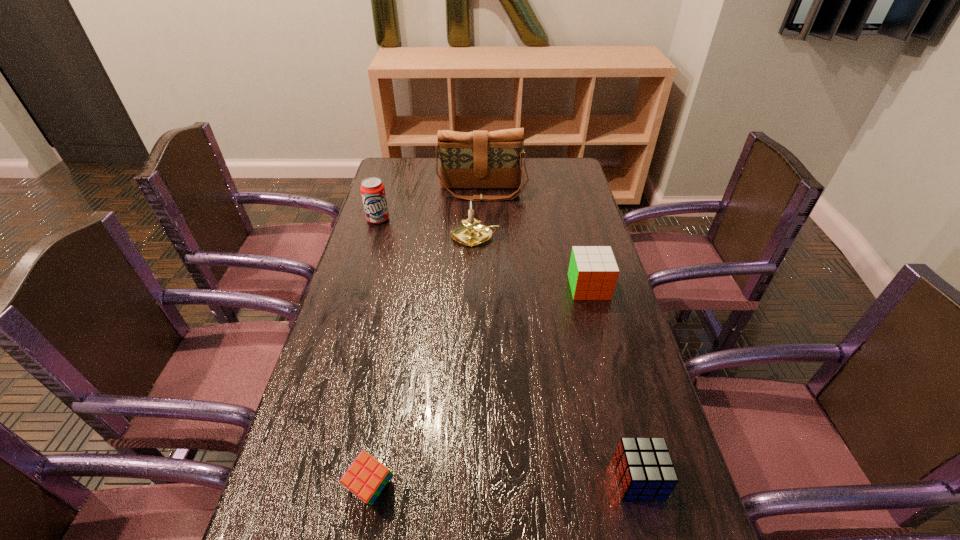
Point out which cube is positioned as the third nearest to the tallest object. Please provide its 2D coordinates. Your answer should be formatted as a tuple, i.e. [(x, y)], where the tuple contains the x and y coordinates of a point satisfying the conditions above.

[(366, 477)]

Where is `free space that satisfies the following two spatial constraints: 1. on the front-facing side of the shoulder bag; 2. on the handle side of the candle holder`? Image resolution: width=960 pixels, height=540 pixels. free space that satisfies the following two spatial constraints: 1. on the front-facing side of the shoulder bag; 2. on the handle side of the candle holder is located at coordinates (483, 237).

The width and height of the screenshot is (960, 540). Identify the location of vacant space that satisfies the following two spatial constraints: 1. on the front-facing side of the shoulder bag; 2. on the right side of the tallest cube. (483, 287).

Find the location of a particular element. The width and height of the screenshot is (960, 540). vacant space that satisfies the following two spatial constraints: 1. on the front-facing side of the tallest object; 2. on the right side of the third nearest object is located at coordinates (483, 287).